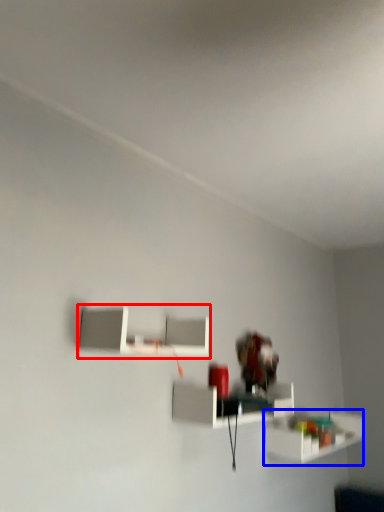
Question: Among these objects, which one is farthest to the camera, shelf (highlighted by a red box) or shelf (highlighted by a blue box)?

Choices:
 (A) shelf
 (B) shelf

Answer: (B)